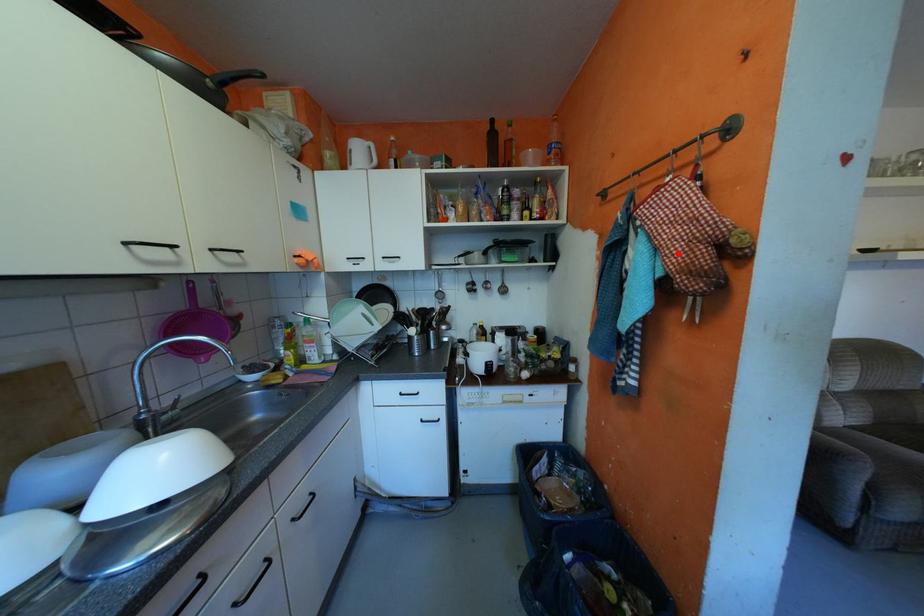
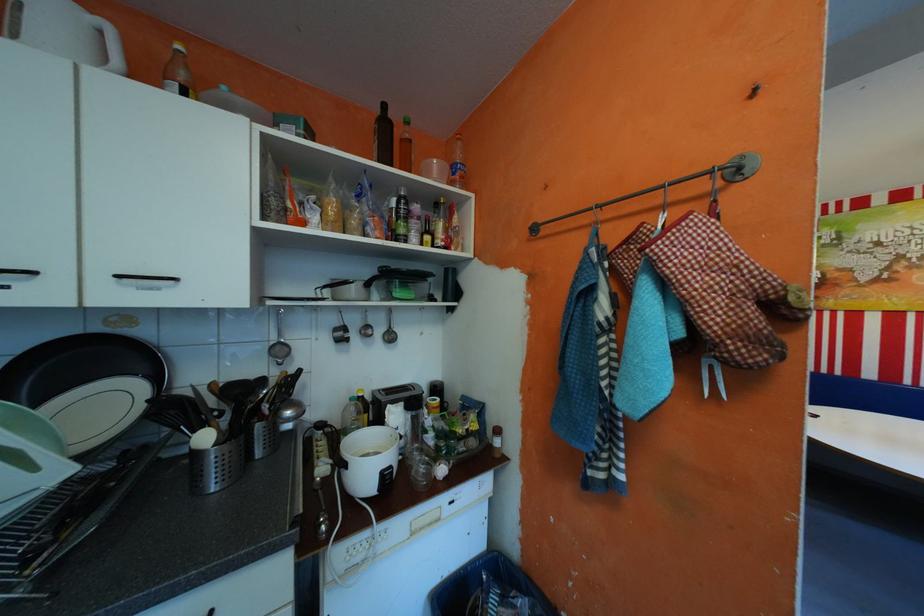
Where in the second image is the point corresponding to the highlighted location from the first image?

(715, 310)